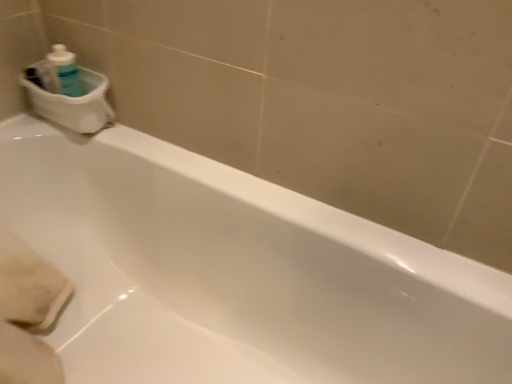
What do you see at coordinates (236, 273) in the screenshot? I see `white glossy bathtub at upper left` at bounding box center [236, 273].

Where is `white glossy bathtub at upper left`? The image size is (512, 384). white glossy bathtub at upper left is located at coordinates (236, 273).

What is the approximate height of white glossy bathtub at upper left?

22.60 inches.

At what (x,y) coordinates should I click in order to perform the action: click on white glossy bathtub at upper left. Please return your answer as a coordinate pair (x, y). Image resolution: width=512 pixels, height=384 pixels. Looking at the image, I should click on (236, 273).